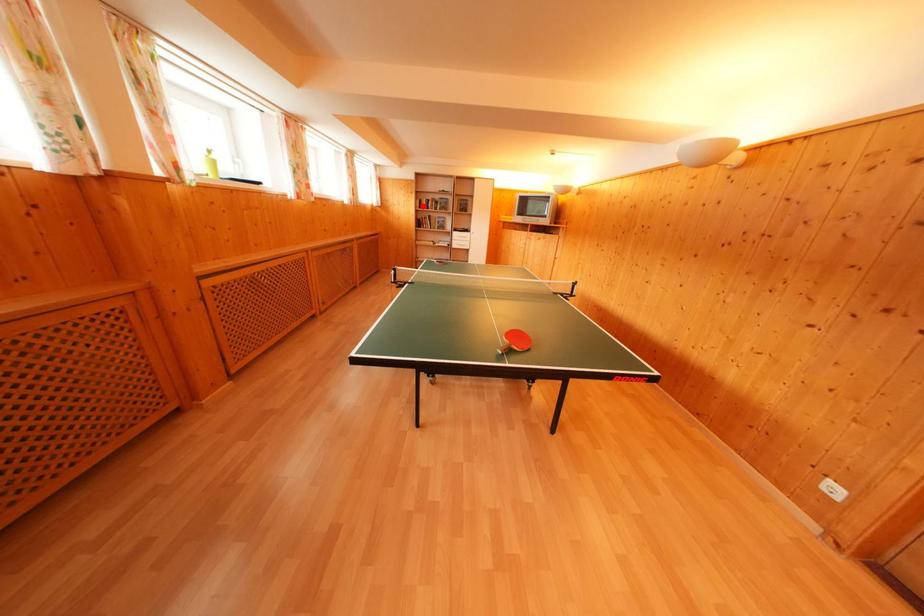
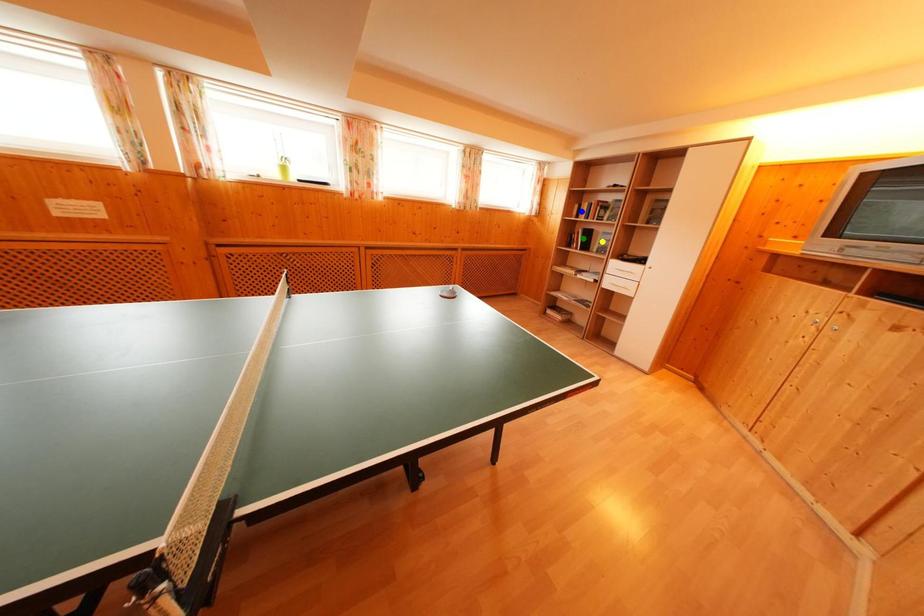
Question: I am providing you with two images of the same scene from different viewpoints. A red point is marked on the first image. You are given multiple points on the second image. In image 2, which mark is for the same physical point as the one in image 1?

Choices:
 (A) green point
 (B) yellow point
 (C) blue point

Answer: (C)